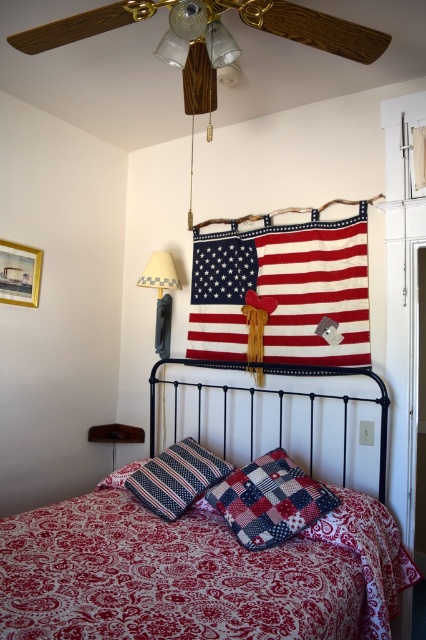
Question: Is matte glass lamp at upper center above patterned fabric pillow at center?

Choices:
 (A) yes
 (B) no

Answer: (A)

Question: Which is farther from the checkered fabric lampshade at upper left?

Choices:
 (A) patchwork fabric pillow at center
 (B) matte glass lamp at upper center

Answer: (B)

Question: Does red paisley fabric bed at center appear under american flag at center?

Choices:
 (A) no
 (B) yes

Answer: (B)

Question: Which point appears farthest from the camera in this image?

Choices:
 (A) (264, 20)
 (B) (294, 522)
 (C) (152, 506)

Answer: (C)

Question: Is black metal headboard at center further to the viewer compared to checkered fabric lampshade at upper left?

Choices:
 (A) yes
 (B) no

Answer: (B)

Question: Which object is closer to the camera taking this photo?

Choices:
 (A) patterned fabric pillow at center
 (B) red paisley fabric bed at center
 (C) american flag at center
 (D) black metal headboard at center

Answer: (B)